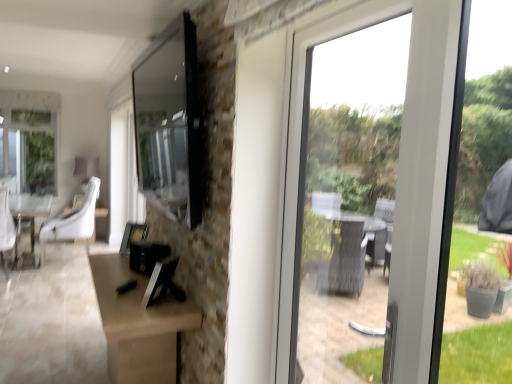
Question: Considering the relative positions of matte black tv at upper center and white leather swivel chair at left in the image provided, is matte black tv at upper center to the left of white leather swivel chair at left from the viewer's perspective?

Choices:
 (A) no
 (B) yes

Answer: (A)

Question: Is matte black tv at upper center next to white leather swivel chair at left and touching it?

Choices:
 (A) no
 (B) yes

Answer: (A)

Question: Is matte black tv at upper center positioned behind white leather swivel chair at left?

Choices:
 (A) yes
 (B) no

Answer: (B)

Question: Does matte black tv at upper center have a greater width compared to white leather swivel chair at left?

Choices:
 (A) no
 (B) yes

Answer: (A)

Question: From a real-world perspective, does matte black tv at upper center stand above white leather swivel chair at left?

Choices:
 (A) no
 (B) yes

Answer: (B)

Question: Is point 79,213 closer or farther from the camera than point 177,125?

Choices:
 (A) closer
 (B) farther

Answer: (B)

Question: From the image's perspective, is white fabric chair at center above or below matte black tv at upper center?

Choices:
 (A) below
 (B) above

Answer: (A)

Question: Is white fabric chair at center in front of or behind matte black tv at upper center in the image?

Choices:
 (A) behind
 (B) front

Answer: (A)

Question: From a real-world perspective, is white fabric chair at center above or below matte black tv at upper center?

Choices:
 (A) below
 (B) above

Answer: (A)

Question: From the image's perspective, relative to white fabric chair at center, is white leather swivel chair at left above or below?

Choices:
 (A) above
 (B) below

Answer: (B)

Question: Is white leather swivel chair at left taller or shorter than white fabric chair at center?

Choices:
 (A) short
 (B) tall

Answer: (B)

Question: In the image, is white leather swivel chair at left positioned in front of or behind white fabric chair at center?

Choices:
 (A) front
 (B) behind

Answer: (A)

Question: In terms of width, does white leather swivel chair at left look wider or thinner when compared to white fabric chair at center?

Choices:
 (A) wide
 (B) thin

Answer: (B)

Question: From a real-world perspective, is white leather swivel chair at left above or below matte black tv at upper center?

Choices:
 (A) below
 (B) above

Answer: (A)

Question: In the image, is white leather swivel chair at left on the left side or the right side of matte black tv at upper center?

Choices:
 (A) left
 (B) right

Answer: (A)